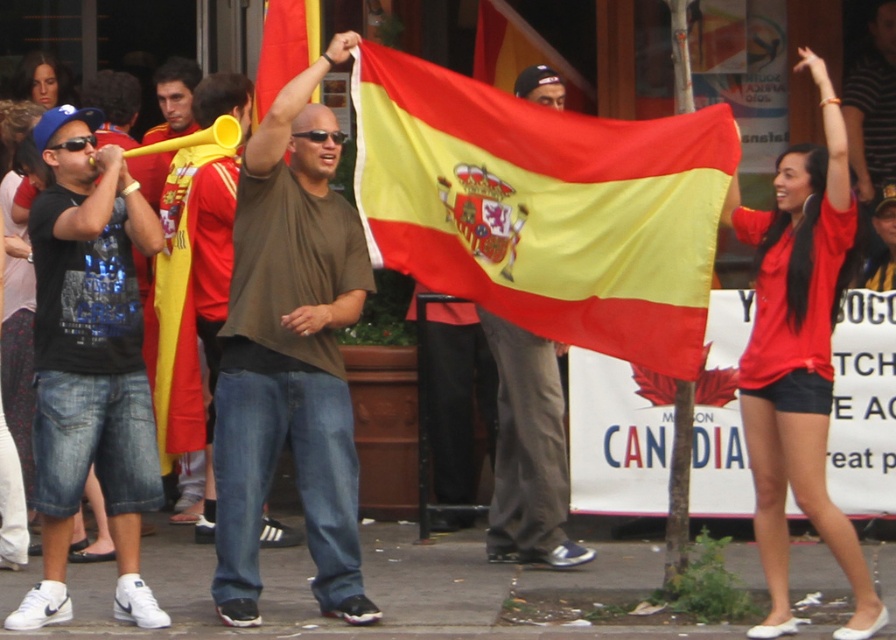
Does black denim shorts at left appear under matte red shirt at center?

Correct, black denim shorts at left is located below matte red shirt at center.

Can you confirm if black denim shorts at left is thinner than matte red shirt at center?

No, black denim shorts at left is not thinner than matte red shirt at center.

The width and height of the screenshot is (896, 640). Find the location of `black denim shorts at left`. black denim shorts at left is located at coordinates (89, 362).

Is matte red shirt at center behind red/yellow fabric flag at center?

No, matte red shirt at center is closer to the viewer.

Find the location of a particular element. matte red shirt at center is located at coordinates (799, 356).

Can you confirm if red/yellow fabric flag at center is taller than matte yellow horn at center?

Yes.

Does red/yellow fabric flag at center come behind matte yellow horn at center?

No.

At what (x,y) coordinates should I click in order to perform the action: click on red/yellow fabric flag at center. Please return your answer as a coordinate pair (x, y). The width and height of the screenshot is (896, 640). Looking at the image, I should click on (283, 49).